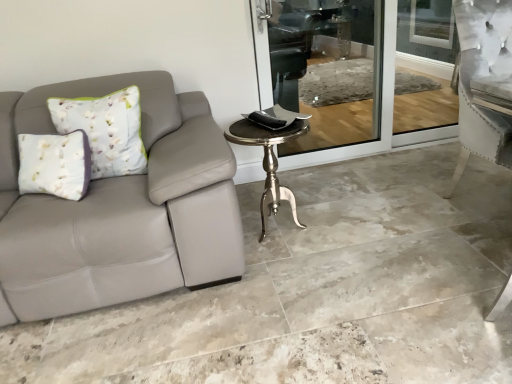
Question: Is gray tile floor at lower left spatially inside polished brass table at center, or outside of it?

Choices:
 (A) inside
 (B) outside

Answer: (B)

Question: In terms of size, does gray tile floor at lower left appear bigger or smaller than polished brass table at center?

Choices:
 (A) big
 (B) small

Answer: (A)

Question: In terms of width, does gray tile floor at lower left look wider or thinner when compared to polished brass table at center?

Choices:
 (A) wide
 (B) thin

Answer: (A)

Question: Is polished brass table at center to the left or to the right of gray tile floor at lower left in the image?

Choices:
 (A) left
 (B) right

Answer: (A)

Question: Considering the positions of point (276, 139) and point (147, 319), is point (276, 139) closer or farther from the camera than point (147, 319)?

Choices:
 (A) closer
 (B) farther

Answer: (B)

Question: Is polished brass table at center bigger or smaller than gray tile floor at lower left?

Choices:
 (A) small
 (B) big

Answer: (A)

Question: Considering the positions of polished brass table at center and gray tile floor at lower left in the image, is polished brass table at center wider or thinner than gray tile floor at lower left?

Choices:
 (A) wide
 (B) thin

Answer: (B)